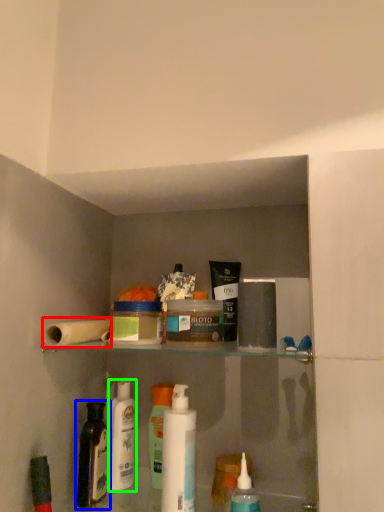
Question: Based on their relative distances, which object is nearer to toilet paper (highlighted by a red box)? Choose from bottle (highlighted by a blue box) and toiletry (highlighted by a green box).

Choices:
 (A) bottle
 (B) toiletry

Answer: (A)